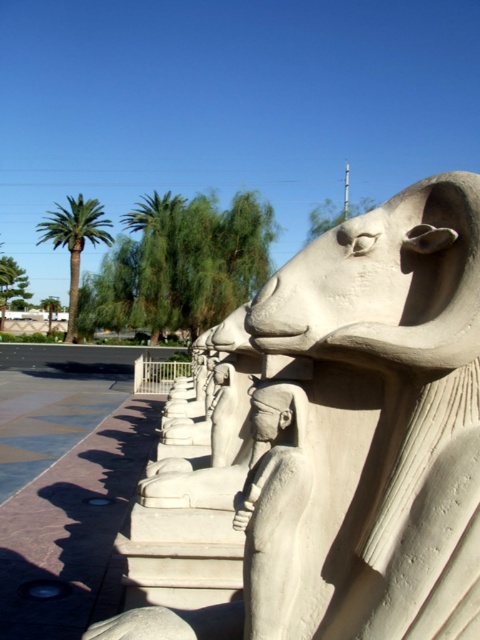
You are a tour guide leading a group along the pathway between the white stone sphinx at center and the green leafy palm tree at upper center. The pathway is 70 feet wide. Can your group safely walk through the path without needing to go around?

The distance between the white stone sphinx at center and the green leafy palm tree at upper center is 69.68 feet, which is slightly less than the 70 feet width of the pathway. Therefore, the group can safely walk through the path without needing to go around.

You are standing on the pathway between the white stone sphinx at center and the green leafy palm tree at upper center. Which object is closer to your right side?

The white stone sphinx at center is closer to your right side since it is positioned to the right of the green leafy palm tree at upper center.